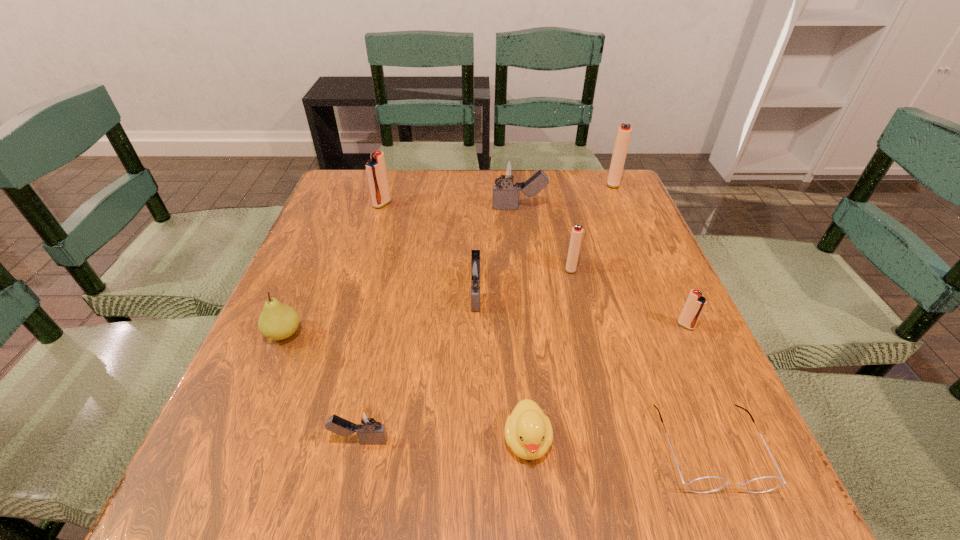
Where is `vacant space located on the front of the ninth object from right to left`? The height and width of the screenshot is (540, 960). vacant space located on the front of the ninth object from right to left is located at coordinates (374, 229).

Locate an element on the screen. vacant space situated on the right of the farthest gray igniter is located at coordinates (639, 208).

At what (x,y) coordinates should I click in order to perform the action: click on vacant position located 0.300m on the right of the fifth igniter from right to left. Please return your answer as a coordinate pair (x, y). Image resolution: width=960 pixels, height=540 pixels. Looking at the image, I should click on (631, 293).

This screenshot has height=540, width=960. Find the location of `free space located 0.210m on the front of the fourth farthest object`. free space located 0.210m on the front of the fourth farthest object is located at coordinates (589, 348).

Where is `vacant area located 0.070m on the back of the leftmost object`? vacant area located 0.070m on the back of the leftmost object is located at coordinates (300, 295).

Where is `vacant space located on the left of the sixth farthest igniter`? vacant space located on the left of the sixth farthest igniter is located at coordinates (628, 326).

The height and width of the screenshot is (540, 960). I want to click on free space located on the right of the nearest gray igniter, so click(x=641, y=441).

Identify the location of blank area located on the beak of the yellow duckling. [x=535, y=521].

I want to click on duckling that is at the near edge, so click(528, 431).

Locate an element on the screen. The image size is (960, 540). spectacles situated at the near edge is located at coordinates (708, 484).